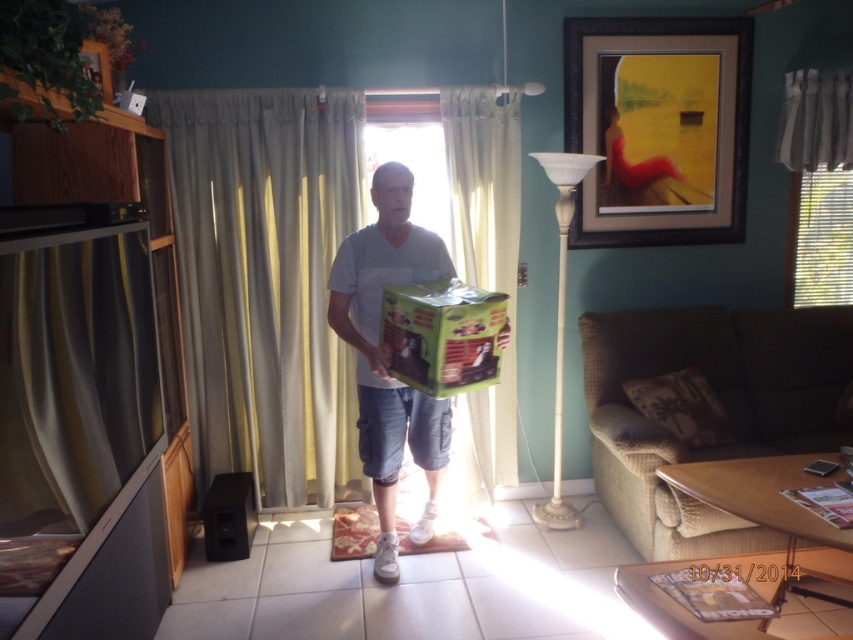
Which is more to the left, white sheer curtain at center or green matte box at center?

green matte box at center is more to the left.

Who is shorter, white sheer curtain at center or green matte box at center?

green matte box at center is shorter.

Is point (490, 208) farther from camera compared to point (465, 337)?

That is True.

Where is `white sheer curtain at center`? The image size is (853, 640). white sheer curtain at center is located at coordinates (483, 182).

Can you confirm if silky yellow curtain at left is positioned to the left of matte green cardboard box at center?

Indeed, silky yellow curtain at left is positioned on the left side of matte green cardboard box at center.

Who is taller, silky yellow curtain at left or matte green cardboard box at center?

With more height is matte green cardboard box at center.

You are a GUI agent. You are given a task and a screenshot of the screen. Output one action in this format:
    pyautogui.click(x=<x>, y=<y>)
    Task: Click on the silky yellow curtain at left
    
    Given the screenshot: What is the action you would take?
    pyautogui.click(x=74, y=380)

Looking at this image, is white sheer curtain at center taller than green matte cardboard box at lower left?

Correct, white sheer curtain at center is much taller as green matte cardboard box at lower left.

Is point (515, 452) farther from viewer compared to point (248, 484)?

Yes.

What are the coordinates of `white sheer curtain at center` in the screenshot? It's located at (483, 182).